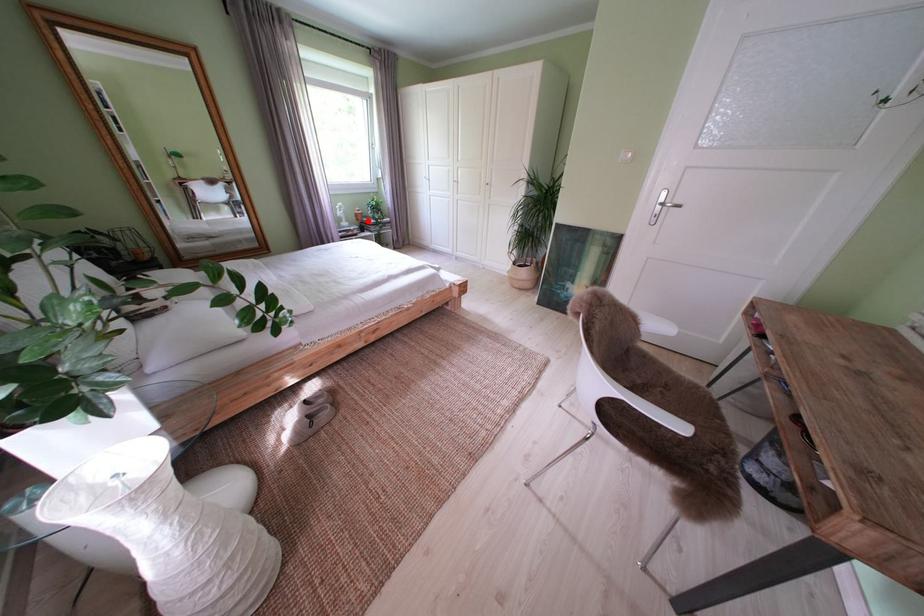
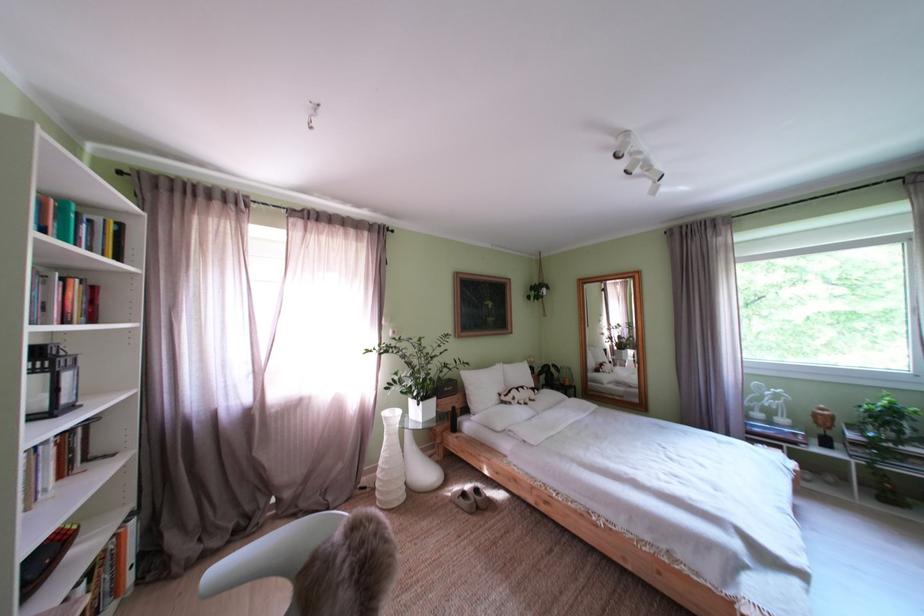
Question: I am providing you with two images of the same scene from different viewpoints. Given a red point in image1, look at the same physical point in image2. Is it:

Choices:
 (A) Closer to the viewpoint
 (B) Farther from the viewpoint

Answer: (B)